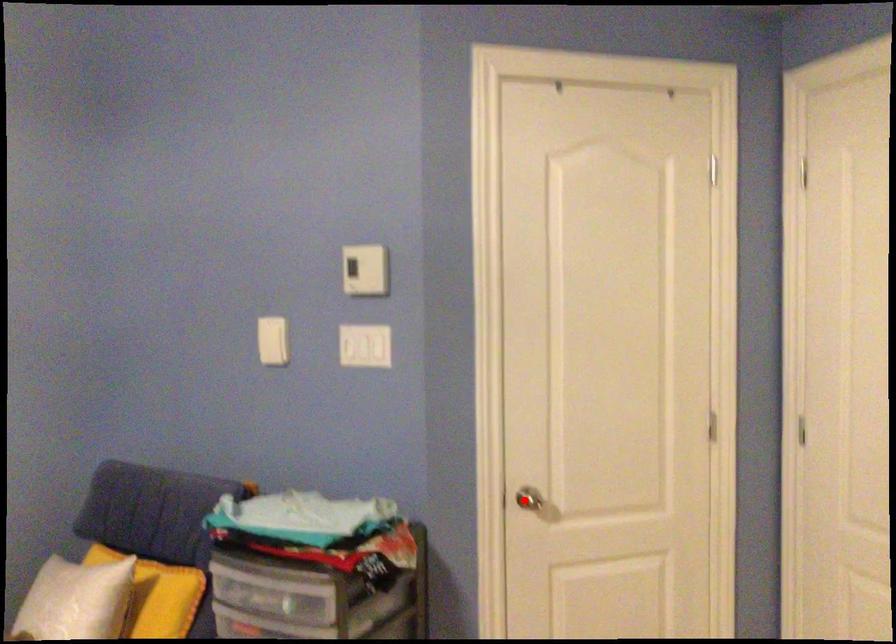
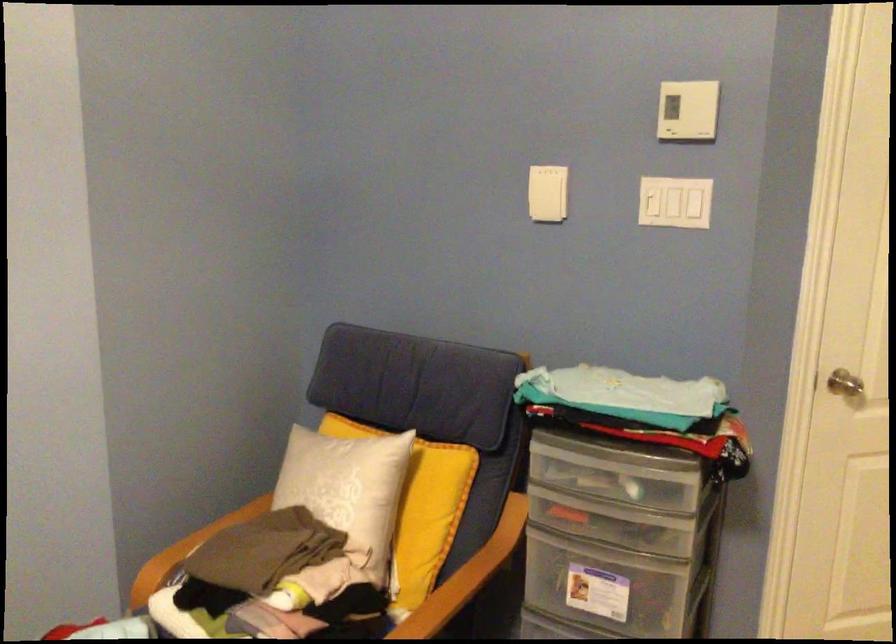
The point at the highlighted location is marked in the first image. Where is the corresponding point in the second image?

(846, 384)